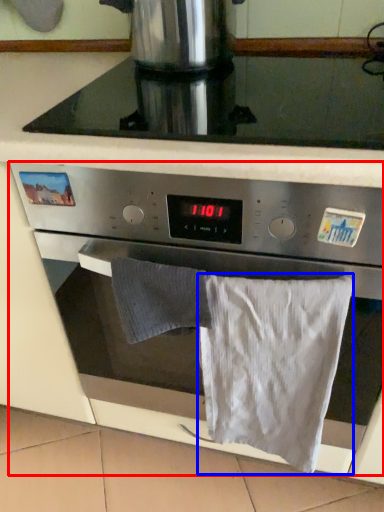
Question: Which point is further to the camera, oven (highlighted by a red box) or bath towel (highlighted by a blue box)?

Choices:
 (A) oven
 (B) bath towel

Answer: (B)